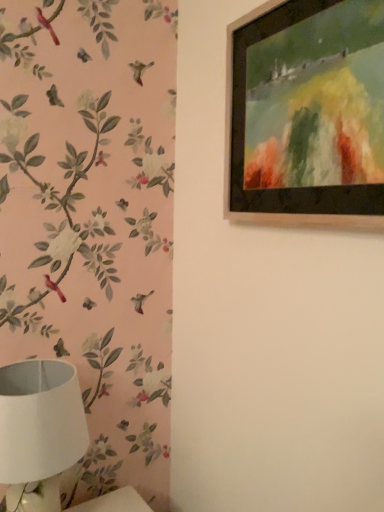
Image resolution: width=384 pixels, height=512 pixels. What do you see at coordinates (39, 431) in the screenshot?
I see `white matte lampshade at lower left` at bounding box center [39, 431].

The height and width of the screenshot is (512, 384). What are the coordinates of `white matte lampshade at lower left` in the screenshot? It's located at (39, 431).

What is the approximate width of white matte lampshade at lower left?

9.89 inches.

Find the location of `wooden picture frame at upper right`. wooden picture frame at upper right is located at coordinates (307, 114).

The width and height of the screenshot is (384, 512). What do you see at coordinates (307, 114) in the screenshot? I see `wooden picture frame at upper right` at bounding box center [307, 114].

Locate an element on the screen. The height and width of the screenshot is (512, 384). white matte lampshade at lower left is located at coordinates (39, 431).

In the image, is wooden picture frame at upper right on the left side or the right side of white matte lampshade at lower left?

In the image, wooden picture frame at upper right appears on the right side of white matte lampshade at lower left.

In the image, is wooden picture frame at upper right positioned in front of or behind white matte lampshade at lower left?

Clearly, wooden picture frame at upper right is in front of white matte lampshade at lower left.

Considering the positions of point (239, 119) and point (20, 498), is point (239, 119) closer or farther from the camera than point (20, 498)?

Point (239, 119) is farther from the camera than point (20, 498).

Consider the image. From the image's perspective, is wooden picture frame at upper right located beneath white matte lampshade at lower left?

No, from the image's perspective, wooden picture frame at upper right is not below white matte lampshade at lower left.

From a real-world perspective, relative to white matte lampshade at lower left, is wooden picture frame at upper right vertically above or below?

In terms of real-world spatial position, wooden picture frame at upper right is above white matte lampshade at lower left.

Is wooden picture frame at upper right wider than white matte lampshade at lower left?

No, wooden picture frame at upper right is not wider than white matte lampshade at lower left.

In terms of height, does wooden picture frame at upper right look taller or shorter compared to white matte lampshade at lower left?

In the image, wooden picture frame at upper right appears to be taller than white matte lampshade at lower left.

Considering the sizes of objects wooden picture frame at upper right and white matte lampshade at lower left in the image provided, who is smaller, wooden picture frame at upper right or white matte lampshade at lower left?

wooden picture frame at upper right is smaller.

Is wooden picture frame at upper right inside or outside of white matte lampshade at lower left?

wooden picture frame at upper right lies outside white matte lampshade at lower left.

Would you say wooden picture frame at upper right is a long distance from white matte lampshade at lower left?

That's not correct — wooden picture frame at upper right is a little close to white matte lampshade at lower left.

Looking at this image, is wooden picture frame at upper right facing towards white matte lampshade at lower left?

No, wooden picture frame at upper right does not turn towards white matte lampshade at lower left.

How different are the orientations of wooden picture frame at upper right and white matte lampshade at lower left in degrees?

There is a 94-degree angle between the facing directions of wooden picture frame at upper right and white matte lampshade at lower left.

This screenshot has width=384, height=512. What are the coordinates of `table lamp below the wooden picture frame at upper right (from the image's perspective)` in the screenshot? It's located at (39, 431).

Between white matte lampshade at lower left and wooden picture frame at upper right, which one appears on the right side from the viewer's perspective?

From the viewer's perspective, wooden picture frame at upper right appears more on the right side.

Based on the photo, is the position of white matte lampshade at lower left less distant than that of wooden picture frame at upper right?

No, the depth of white matte lampshade at lower left is greater than that of wooden picture frame at upper right.

Which is closer, (85, 429) or (244, 207)?

The point (244, 207) is in front.

From the image's perspective, is white matte lampshade at lower left positioned above or below wooden picture frame at upper right?

Based on their image positions, white matte lampshade at lower left is located beneath wooden picture frame at upper right.

From a real-world perspective, is white matte lampshade at lower left positioned under wooden picture frame at upper right based on gravity?

Correct, in the physical world, white matte lampshade at lower left is lower than wooden picture frame at upper right.

In the scene shown: Between white matte lampshade at lower left and wooden picture frame at upper right, which one has smaller width?

wooden picture frame at upper right.

Considering the relative sizes of white matte lampshade at lower left and wooden picture frame at upper right in the image provided, is white matte lampshade at lower left taller than wooden picture frame at upper right?

No, white matte lampshade at lower left is not taller than wooden picture frame at upper right.

Can you confirm if white matte lampshade at lower left is bigger than wooden picture frame at upper right?

Correct, white matte lampshade at lower left is larger in size than wooden picture frame at upper right.

Is white matte lampshade at lower left completely or partially outside of wooden picture frame at upper right?

white matte lampshade at lower left lies outside wooden picture frame at upper right's area.

Can you see white matte lampshade at lower left touching wooden picture frame at upper right?

No, white matte lampshade at lower left is not beside wooden picture frame at upper right.

Could you tell me if white matte lampshade at lower left is facing wooden picture frame at upper right?

No, white matte lampshade at lower left is not aimed at wooden picture frame at upper right.

This screenshot has height=512, width=384. In order to click on table lamp located on the left of wooden picture frame at upper right in this screenshot , I will do `click(39, 431)`.

You are a GUI agent. You are given a task and a screenshot of the screen. Output one action in this format:
    pyautogui.click(x=<x>, y=<y>)
    Task: Click on the table lamp on the left of wooden picture frame at upper right
    The height and width of the screenshot is (512, 384).
    Given the screenshot: What is the action you would take?
    pyautogui.click(x=39, y=431)

You are a GUI agent. You are given a task and a screenshot of the screen. Output one action in this format:
    pyautogui.click(x=<x>, y=<y>)
    Task: Click on the table lamp that appears below the wooden picture frame at upper right (from the image's perspective)
    This screenshot has height=512, width=384.
    Given the screenshot: What is the action you would take?
    pyautogui.click(x=39, y=431)